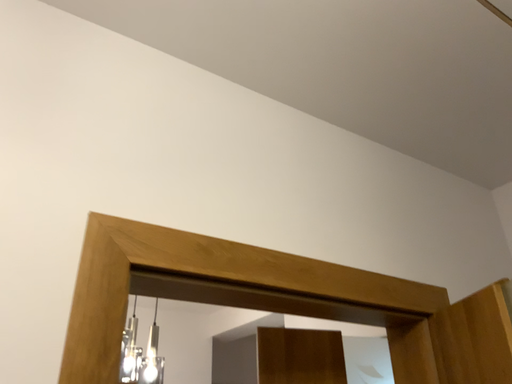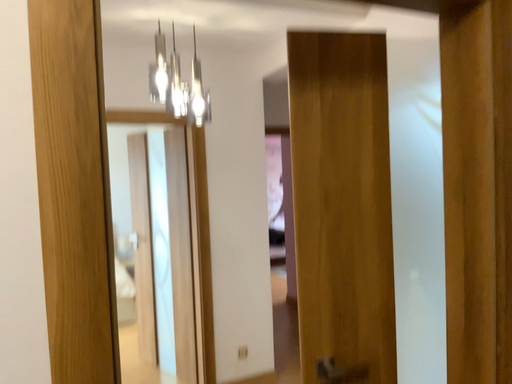
Question: How did the camera likely rotate when shooting the video?

Choices:
 (A) rotated upward
 (B) rotated downward

Answer: (B)